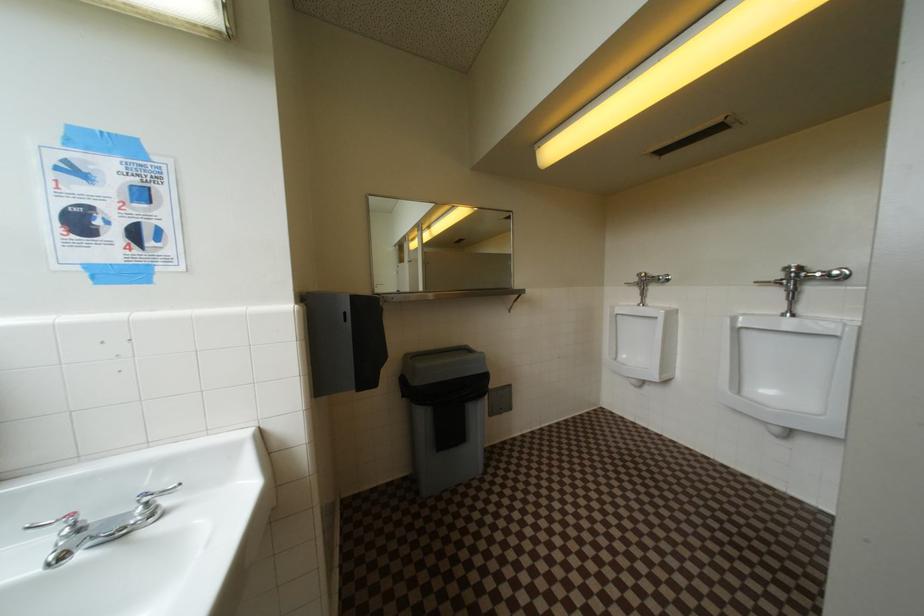
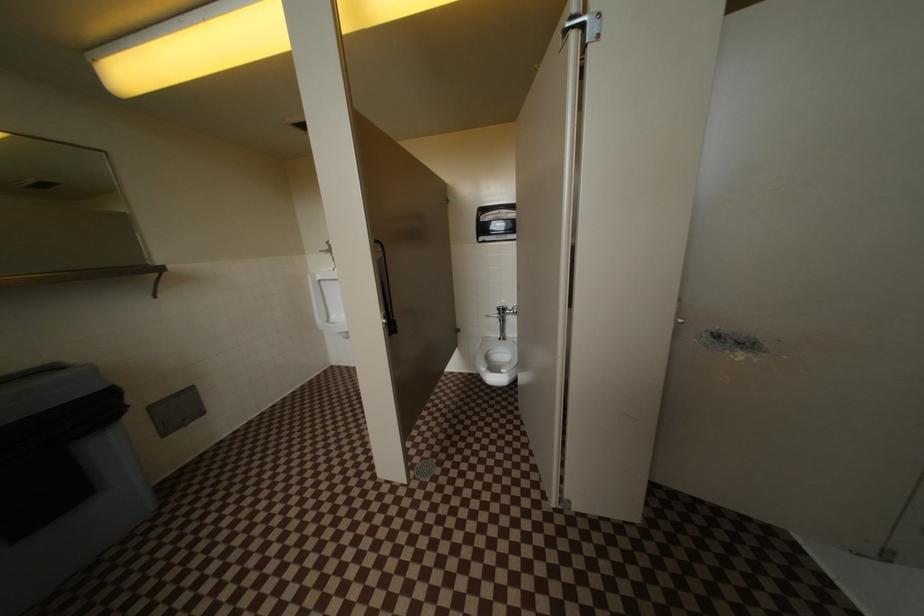
Question: How did the camera likely rotate?

Choices:
 (A) Left
 (B) Right
 (C) Up
 (D) Down

Answer: (B)